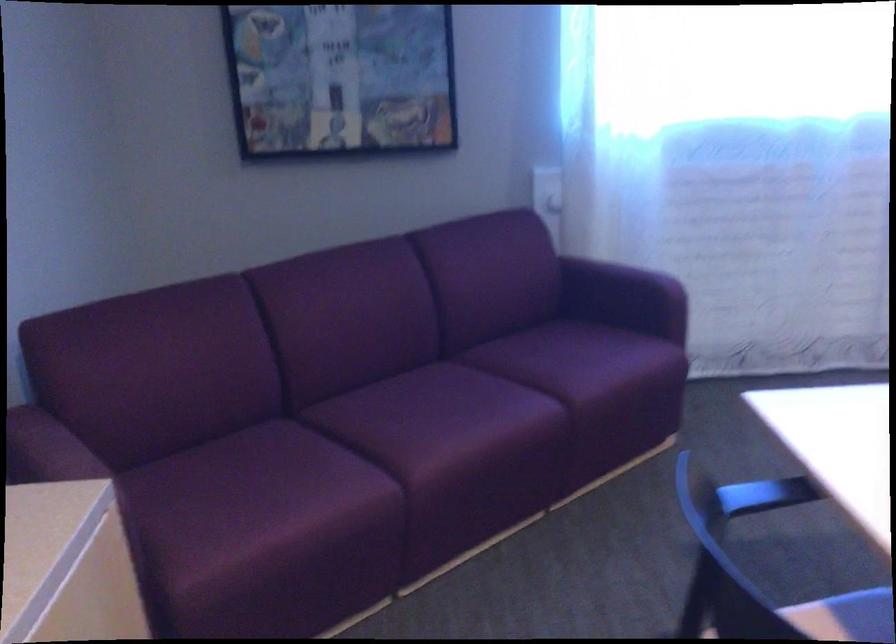
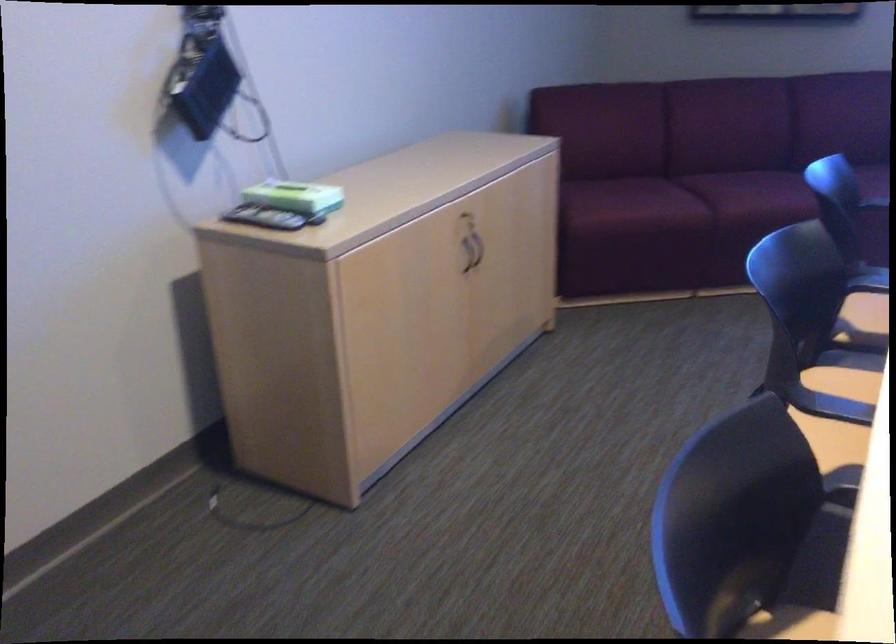
Question: I am providing you with two images of the same scene from different viewpoints. Please identify which objects are invisible in image2.

Choices:
 (A) cabinet lid
 (B) purple sofa armrest
 (C) colored pen
 (D) remote control

Answer: (B)